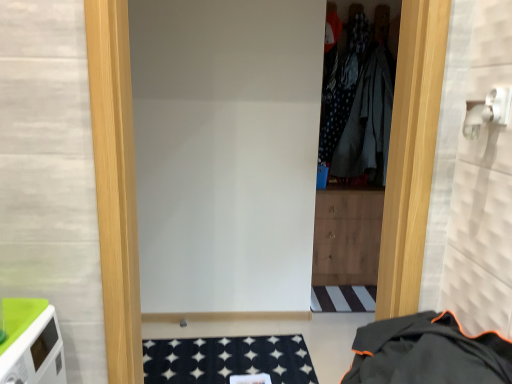
Where is `black fabric jacket at lower right, marked as the 2th clothing in a top-to-bottom arrangement`? black fabric jacket at lower right, marked as the 2th clothing in a top-to-bottom arrangement is located at coordinates (426, 353).

Consider the image. What's the angular difference between white matte door at center and dark grey fabric at center, the 1th clothing in the top-to-bottom sequence,'s facing directions?

They differ by 3.47 degrees in their facing directions.

Does white matte door at center have a smaller size compared to dark grey fabric at center, acting as the second clothing starting from the bottom?

Actually, white matte door at center might be larger than dark grey fabric at center, acting as the second clothing starting from the bottom.

Considering the sizes of objects white matte door at center and dark grey fabric at center, the 2th clothing from the front, in the image provided, who is thinner, white matte door at center or dark grey fabric at center, the 2th clothing from the front,?

dark grey fabric at center, the 2th clothing from the front, is thinner.

From a real-world perspective, who is located lower, white matte door at center or dark grey fabric at center, acting as the second clothing starting from the bottom?

white matte door at center.

Is black fabric jacket at lower right, the 1th clothing viewed from the front, taller or shorter than dark grey fabric at center, the 2th clothing from the front?

In the image, black fabric jacket at lower right, the 1th clothing viewed from the front, appears to be shorter than dark grey fabric at center, the 2th clothing from the front.

From a real-world perspective, which object rests below the other?

In real-world perspective, black fabric jacket at lower right, the 1th clothing viewed from the front, is lower.

Is black fabric jacket at lower right, marked as the 2th clothing in a top-to-bottom arrangement, located outside dark grey fabric at center, acting as the second clothing starting from the bottom?

Yes, black fabric jacket at lower right, marked as the 2th clothing in a top-to-bottom arrangement, is located beyond the bounds of dark grey fabric at center, acting as the second clothing starting from the bottom.

From the image's perspective, between black fabric jacket at lower right, the 1th clothing viewed from the front, and dark grey fabric at center, the first clothing positioned from the back, who is located below?

black fabric jacket at lower right, the 1th clothing viewed from the front.

Considering the points (361, 353) and (137, 284), which point is in front, point (361, 353) or point (137, 284)?

The point (361, 353) is in front.

Consider the image. Considering their positions, is black fabric jacket at lower right, the 1th clothing viewed from the front, located in front of or behind white matte door at center?

Clearly, black fabric jacket at lower right, the 1th clothing viewed from the front, is in front of white matte door at center.

Which object is positioned more to the left, black fabric jacket at lower right, the 1th clothing in the bottom-to-top sequence, or white matte door at center?

white matte door at center.

How many degrees apart are the facing directions of black fabric jacket at lower right, the 1th clothing viewed from the front, and white matte door at center?

91 degrees separate the facing orientations of black fabric jacket at lower right, the 1th clothing viewed from the front, and white matte door at center.

Which of these two, dark grey fabric at center, the first clothing positioned from the back, or black fabric jacket at lower right, the second clothing when ordered from back to front, stands taller?

dark grey fabric at center, the first clothing positioned from the back, is taller.

Is point (345, 141) positioned after point (490, 381)?

Yes.

Which is more to the left, dark grey fabric at center, the first clothing positioned from the back, or black fabric jacket at lower right, the second clothing when ordered from back to front?

black fabric jacket at lower right, the second clothing when ordered from back to front.

How many degrees apart are the facing directions of dark grey fabric at center, the 1th clothing in the top-to-bottom sequence, and black fabric jacket at lower right, the 1th clothing in the bottom-to-top sequence?

The angular difference between dark grey fabric at center, the 1th clothing in the top-to-bottom sequence, and black fabric jacket at lower right, the 1th clothing in the bottom-to-top sequence, is 87.5 degrees.

Based on the photo, is white matte door at center positioned behind black fabric jacket at lower right, the 1th clothing in the bottom-to-top sequence?

Yes, it is behind black fabric jacket at lower right, the 1th clothing in the bottom-to-top sequence.

Which object is positioned more to the left, white matte door at center or black fabric jacket at lower right, the 1th clothing in the bottom-to-top sequence?

white matte door at center.

Does white matte door at center turn towards black fabric jacket at lower right, the 1th clothing viewed from the front?

Yes, white matte door at center faces towards black fabric jacket at lower right, the 1th clothing viewed from the front.

Based on the photo, can you see white matte door at center touching black fabric jacket at lower right, the second clothing when ordered from back to front?

No, white matte door at center is not making contact with black fabric jacket at lower right, the second clothing when ordered from back to front.

Is dark grey fabric at center, the first clothing positioned from the back, oriented towards white matte door at center?

No, dark grey fabric at center, the first clothing positioned from the back, is not turned towards white matte door at center.

Looking at the image, does dark grey fabric at center, the 1th clothing in the top-to-bottom sequence, seem bigger or smaller compared to white matte door at center?

Clearly, dark grey fabric at center, the 1th clothing in the top-to-bottom sequence, is smaller in size than white matte door at center.

Is dark grey fabric at center, acting as the second clothing starting from the bottom, placed right next to white matte door at center?

They are not placed beside each other.

Is point (377, 183) positioned after point (389, 211)?

Yes, point (377, 183) is farther from viewer.

Locate an element on the screen. This screenshot has width=512, height=384. door that is below the dark grey fabric at center, the first clothing positioned from the back (from the image's perspective) is located at coordinates (115, 183).

Identify the location of clothing located above the black fabric jacket at lower right, the 1th clothing in the bottom-to-top sequence (from the image's perspective). The width and height of the screenshot is (512, 384). (362, 105).

From the image, which object appears to be farther from white matte door at center, dark grey fabric at center, the first clothing positioned from the back, or black fabric jacket at lower right, the 1th clothing in the bottom-to-top sequence?

Based on the image, dark grey fabric at center, the first clothing positioned from the back, appears to be further to white matte door at center.

Based on their spatial positions, is white matte door at center or black fabric jacket at lower right, marked as the 2th clothing in a top-to-bottom arrangement, closer to dark grey fabric at center, the 1th clothing in the top-to-bottom sequence?

Among the two, black fabric jacket at lower right, marked as the 2th clothing in a top-to-bottom arrangement, is located nearer to dark grey fabric at center, the 1th clothing in the top-to-bottom sequence.

Considering their positions, is black fabric jacket at lower right, marked as the 2th clothing in a top-to-bottom arrangement, positioned closer to white matte door at center than dark grey fabric at center, the 1th clothing in the top-to-bottom sequence?

black fabric jacket at lower right, marked as the 2th clothing in a top-to-bottom arrangement, lies closer to white matte door at center than the other object.

Estimate the real-world distances between objects in this image. Which object is closer to black fabric jacket at lower right, the 1th clothing in the bottom-to-top sequence, dark grey fabric at center, the 2th clothing from the front, or white matte door at center?

white matte door at center is closer to black fabric jacket at lower right, the 1th clothing in the bottom-to-top sequence.

Based on their spatial positions, is white matte door at center or dark grey fabric at center, the 2th clothing from the front, further from black fabric jacket at lower right, the 1th clothing viewed from the front?

dark grey fabric at center, the 2th clothing from the front, is further to black fabric jacket at lower right, the 1th clothing viewed from the front.

Looking at the image, which one is located further to dark grey fabric at center, acting as the second clothing starting from the bottom, black fabric jacket at lower right, the 1th clothing in the bottom-to-top sequence, or white matte door at center?

white matte door at center.

At what (x,y) coordinates should I click in order to perform the action: click on door positioned between black fabric jacket at lower right, marked as the 2th clothing in a top-to-bottom arrangement, and dark grey fabric at center, the 2th clothing from the front, from near to far. Please return your answer as a coordinate pair (x, y). This screenshot has height=384, width=512. Looking at the image, I should click on (115, 183).